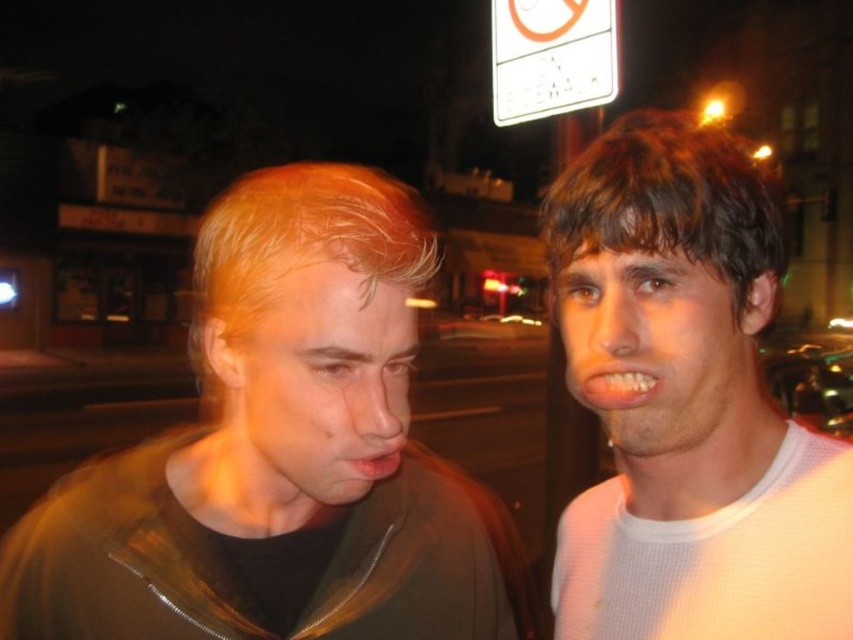
You are a photographer trying to capture a candid shot of the two people in the scene. You want to ensure that both the light brown hair at right and the white plastic sign at upper center are in focus. Given that your camera has a depth of field that can cover 6 feet, will both objects be in focus?

The light brown hair at right and the white plastic sign at upper center are 5.85 feet apart. Since the depth of field can cover 6 feet, both objects will be in focus.

You are a photographer trying to capture a candid shot of the two people in the scene. You notice the matte brown jacket at left and the white plastic sign at upper center. Which object is positioned higher in the frame?

The matte brown jacket at left is taller than the white plastic sign at upper center, so it is positioned higher in the frame.

You are a photographer trying to capture a candid shot of the two people in the scene. You notice the light brown hair at right and the white plastic sign at upper center. Which object is positioned closer to the left side of the frame?

The light brown hair at right is to the left of the white plastic sign at upper center, so the light brown hair at right is positioned closer to the left side of the frame.